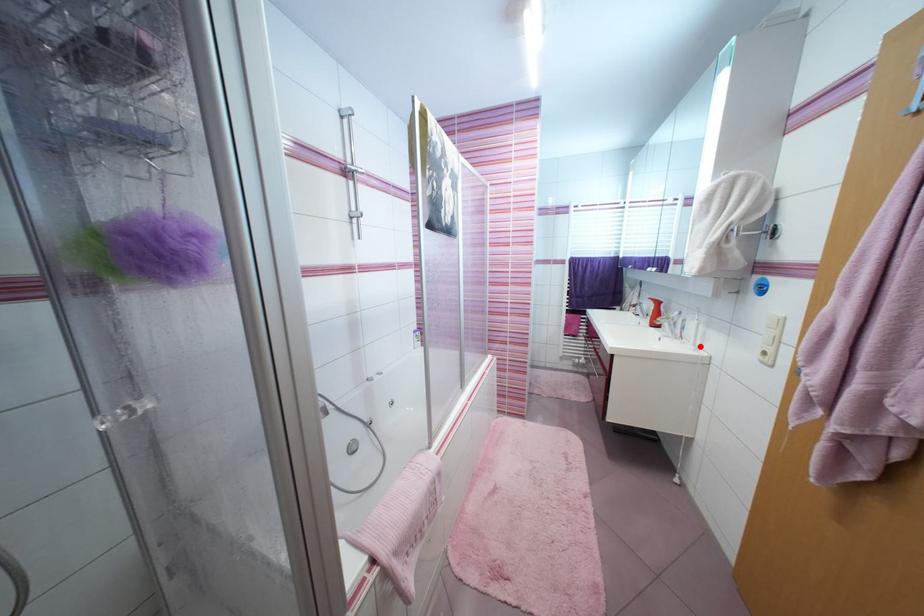
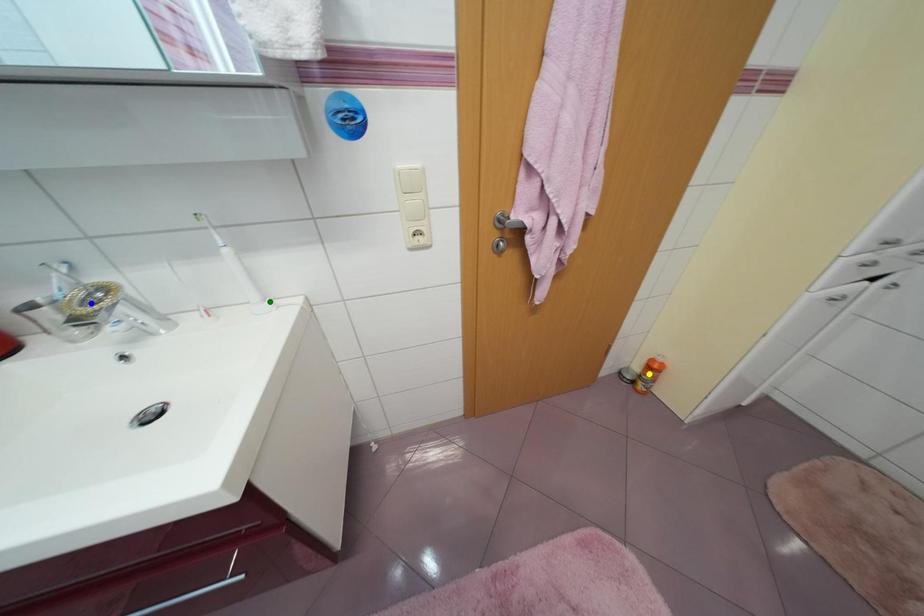
Question: I am providing you with two images of the same scene from different viewpoints. A red point is marked on the first image. You are given multiple points on the second image. Which point in image 2 is actually the same real-world point as the red point in image 1?

Choices:
 (A) yellow point
 (B) blue point
 (C) green point

Answer: (C)